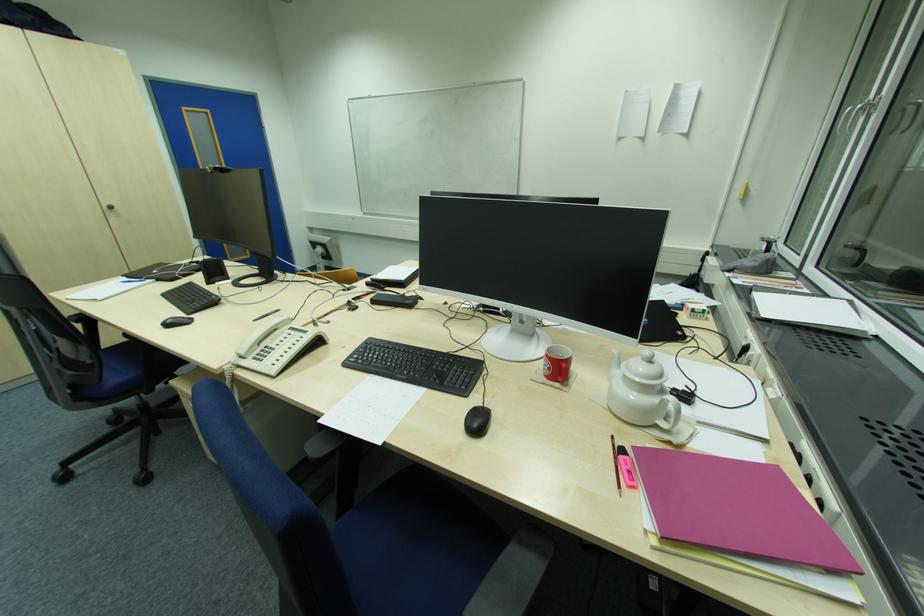
Describe the element at coordinates (626, 467) in the screenshot. I see `the red pencil` at that location.